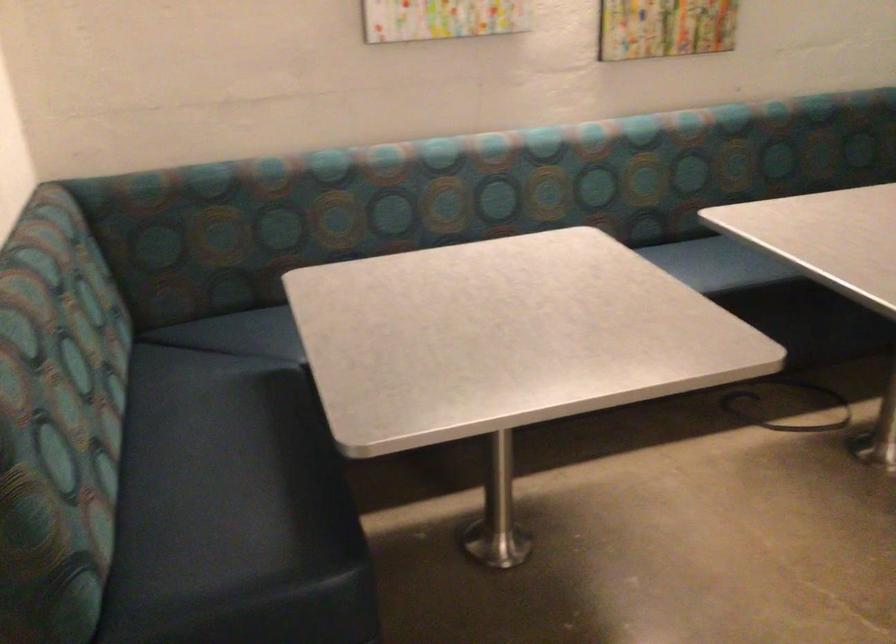
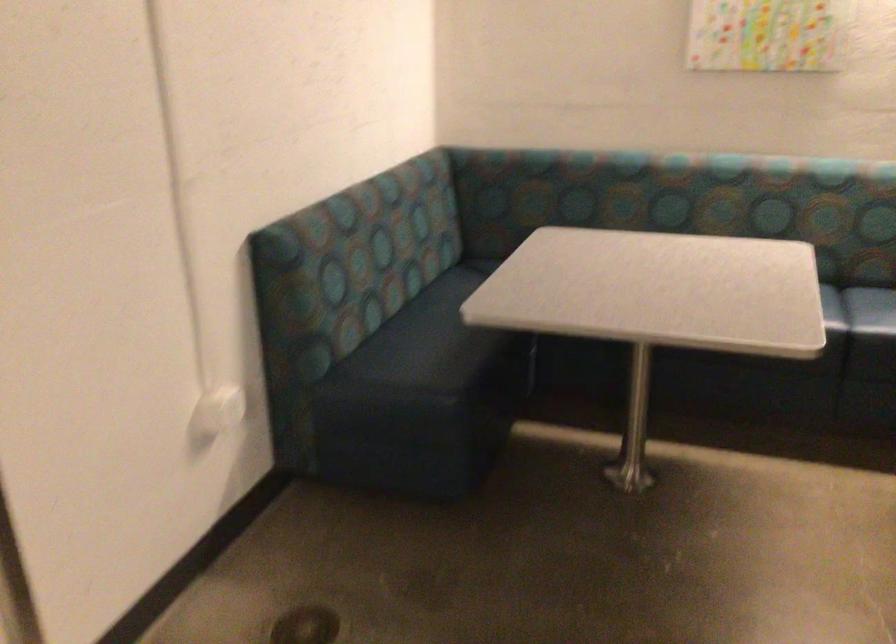
The point at (234, 468) is marked in the first image. Where is the corresponding point in the second image?

(440, 337)